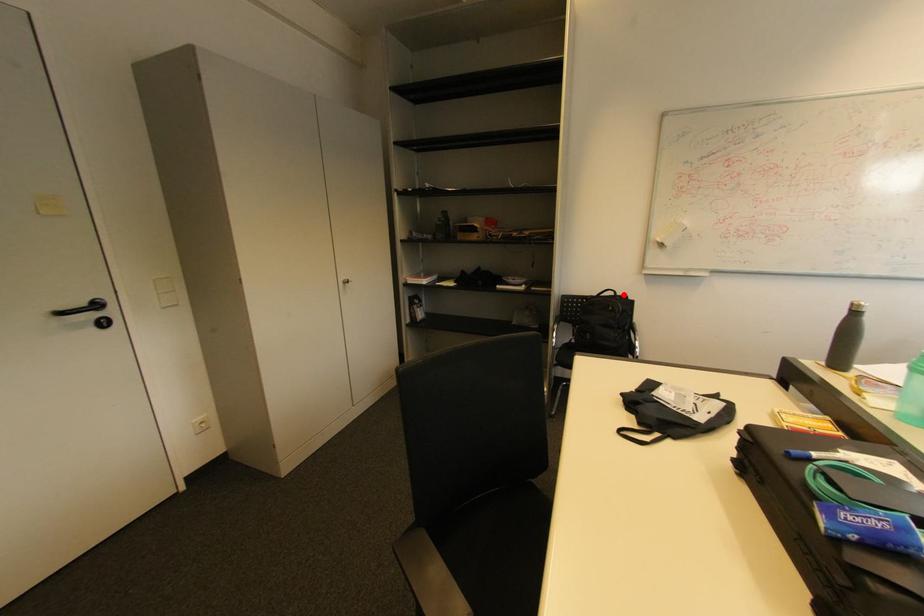
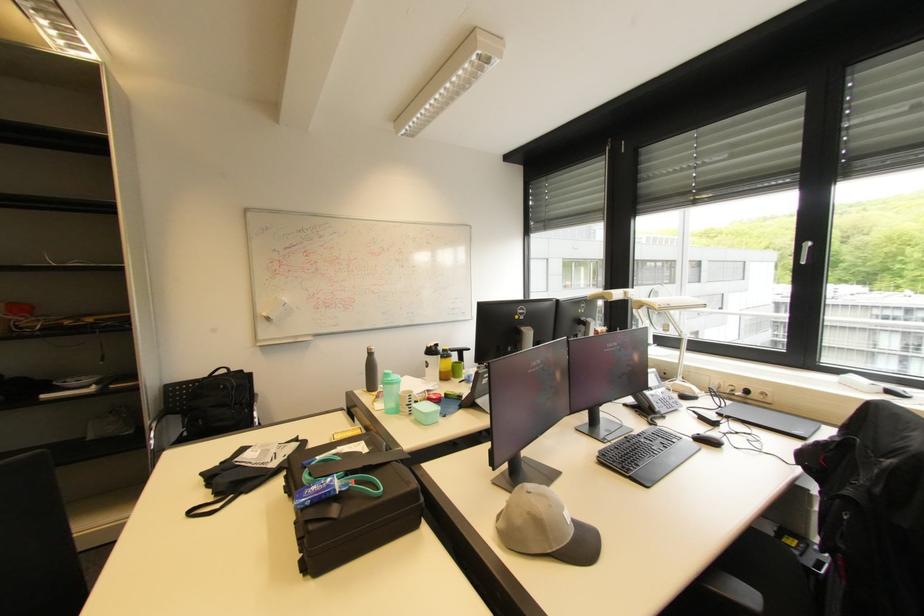
Where in the second image is the point corresponding to the highlighted location from the first image?

(237, 371)